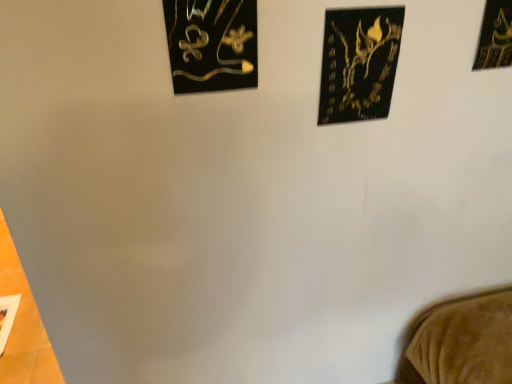
Question: Is black matte picture frame at upper right, acting as the 3th picture frame starting from the left, situated inside metallic gold artwork at upper left, arranged as the 1th picture frame when viewed from the left, or outside?

Choices:
 (A) outside
 (B) inside

Answer: (A)

Question: Is black matte picture frame at upper right, acting as the 3th picture frame starting from the left, in front of or behind metallic gold artwork at upper left, arranged as the 1th picture frame when viewed from the left, in the image?

Choices:
 (A) front
 (B) behind

Answer: (B)

Question: Estimate the real-world distances between objects in this image. Which object is farther from the black matte picture frame at upper center, the 2th picture frame from the left?

Choices:
 (A) metallic gold artwork at upper left, the third picture frame when ordered from right to left
 (B) black matte picture frame at upper right, acting as the first picture frame starting from the right

Answer: (B)

Question: Which of these objects is positioned closest to the metallic gold artwork at upper left, the third picture frame when ordered from right to left?

Choices:
 (A) black matte picture frame at upper right, acting as the 3th picture frame starting from the left
 (B) black matte picture frame at upper center, the 2th picture frame from the left

Answer: (B)